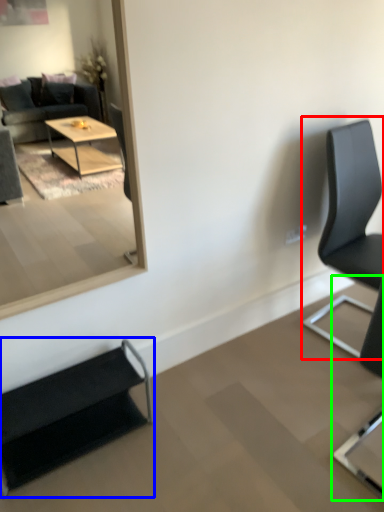
Question: Based on their relative distances, which object is farther from chair (highlighted by a red box)? Choose from chair (highlighted by a blue box) and chair (highlighted by a green box).

Choices:
 (A) chair
 (B) chair

Answer: (A)